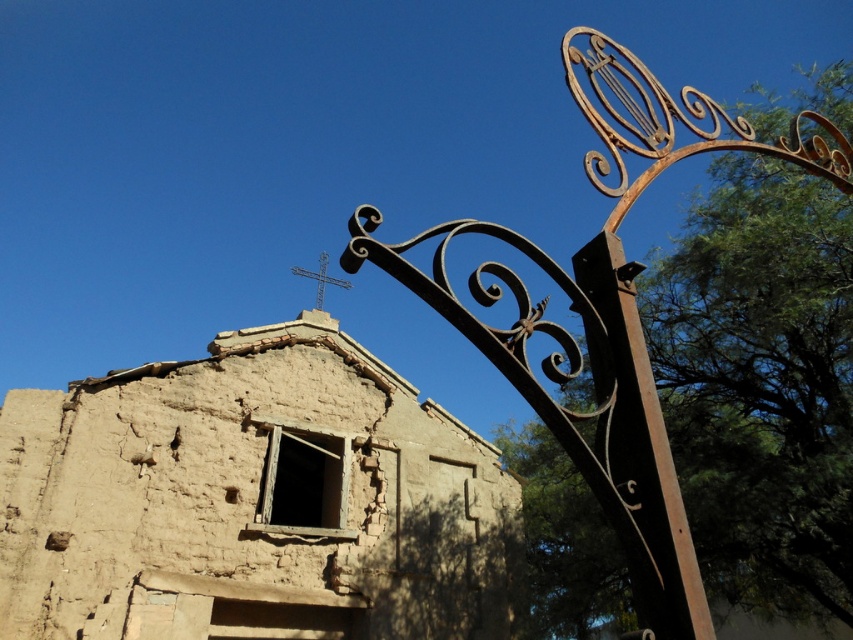
Question: Does rusty metal gate at upper right lie in front of rusty metal pole at right?

Choices:
 (A) yes
 (B) no

Answer: (B)

Question: Can you confirm if rusty metal gate at upper right is positioned above rusty metal pole at right?

Choices:
 (A) no
 (B) yes

Answer: (B)

Question: Which of the following is the closest to the observer?

Choices:
 (A) (642, 385)
 (B) (560, 416)

Answer: (B)

Question: Observing the image, what is the correct spatial positioning of rusty metal gate at upper right in reference to rusty metal pole at right?

Choices:
 (A) left
 (B) right

Answer: (B)

Question: Among these points, which one is nearest to the camera?

Choices:
 (A) (668, 474)
 (B) (633, 282)

Answer: (A)